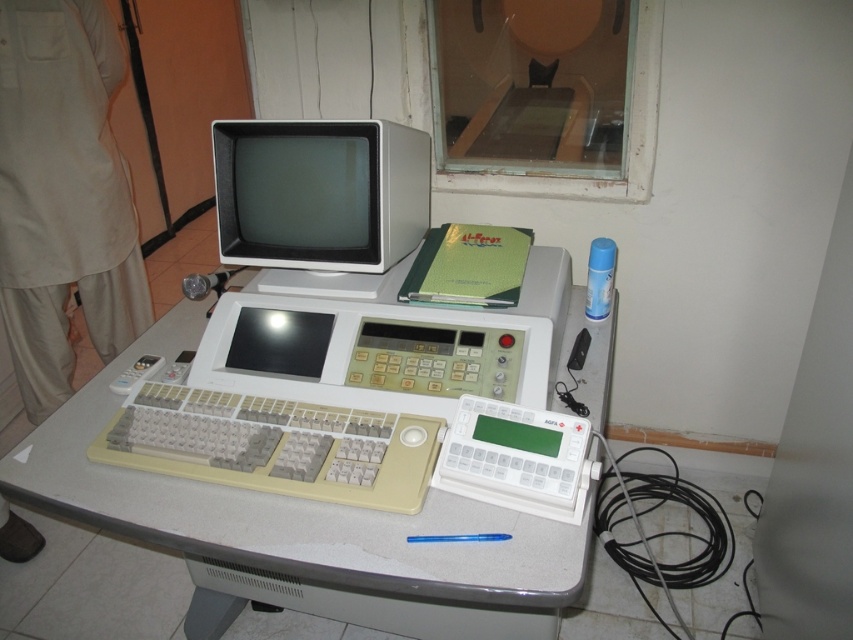
You are a technician trying to set up a vintage computer. You have a white plastic table at center and a beige plastic keyboard at center. Which object is taller?

The white plastic table at center is much taller than the beige plastic keyboard at center.

You are standing in front of the vintage computer setup. The monitor is at point (320, 193). Where is the matte white monitor at center located?

The matte white monitor at center is located at point (320, 193).

You are a technician trying to access the keyboard of the vintage computer setup. You are currently facing the matte white monitor at center. Which direction should you move to reach the beige plastic keyboard at center?

The beige plastic keyboard at center is behind the matte white monitor at center, so you should move backward to reach it.